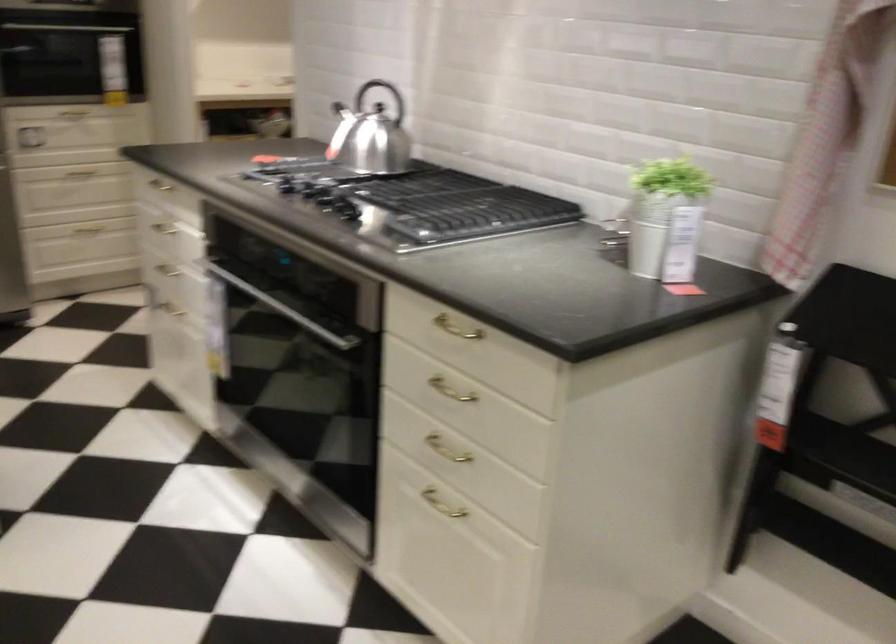
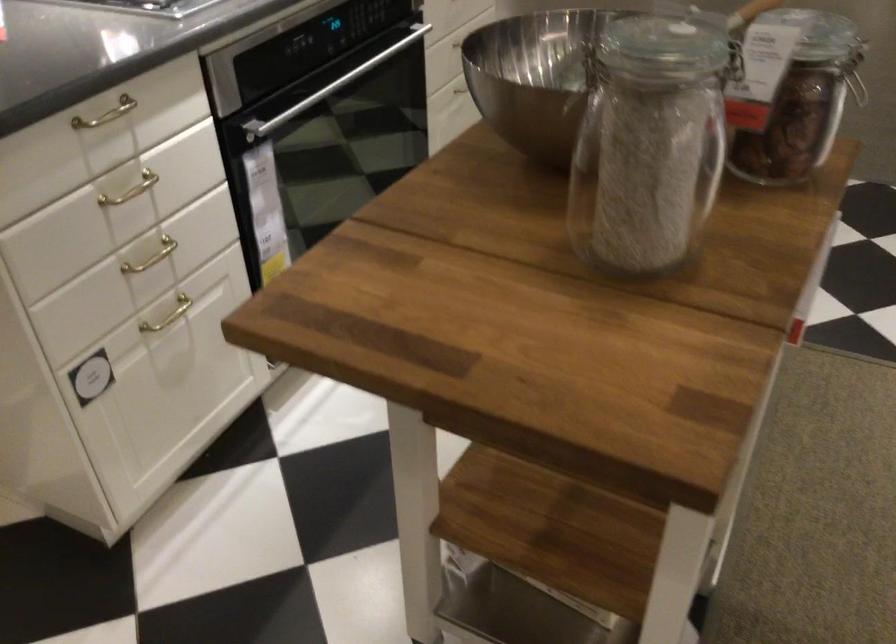
Where in the second image is the point corresponding to pixel 170 263 from the first image?

(151, 257)